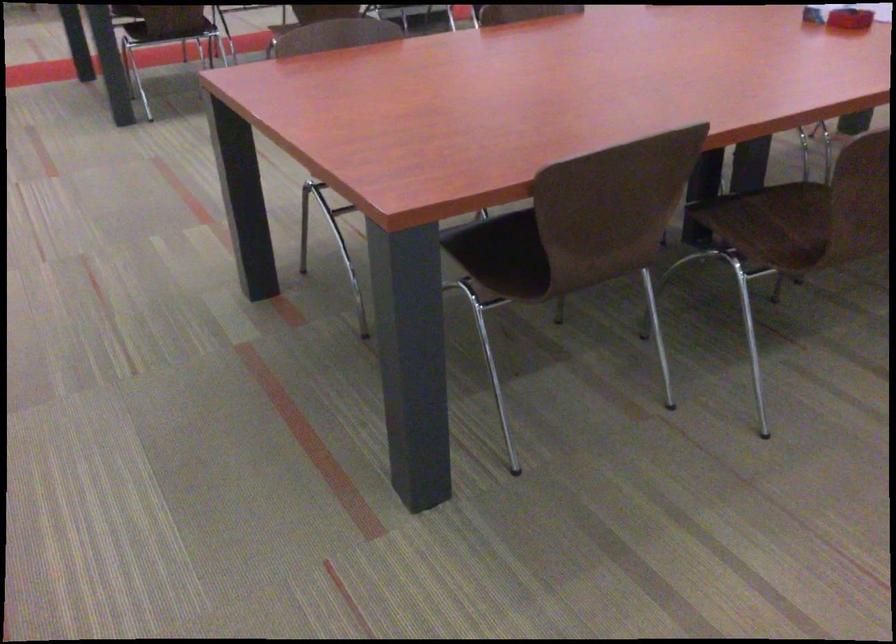
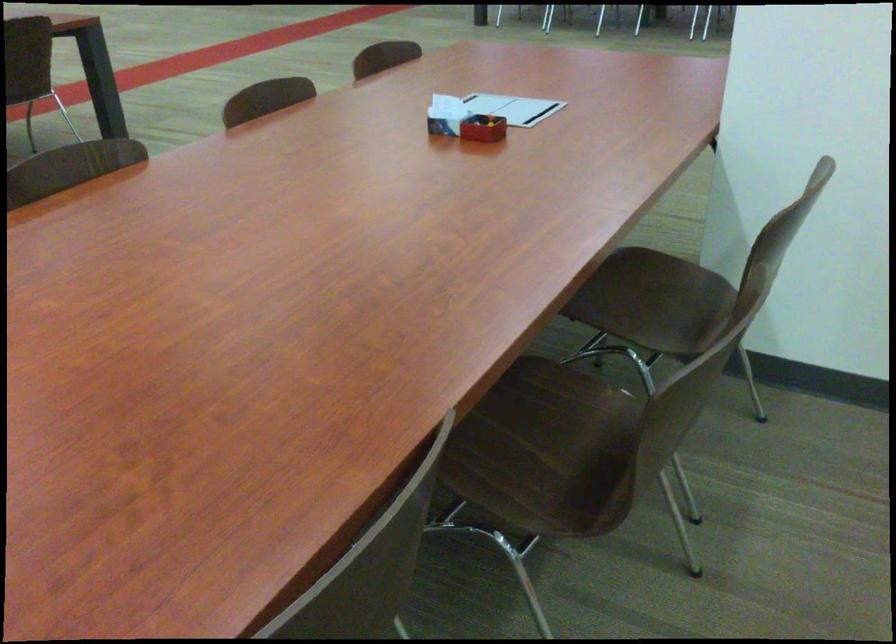
The point at (795, 218) is marked in the first image. Where is the corresponding point in the second image?

(541, 428)